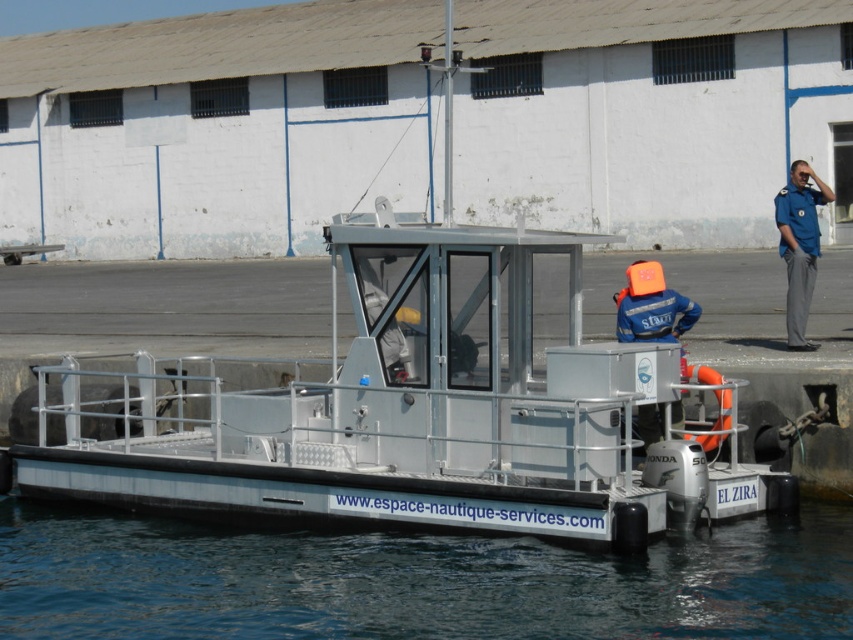
Looking at this image, who is shorter, blue water at lower center or orange rubber life jacket at right?

blue water at lower center

Between blue water at lower center and orange rubber life jacket at right, which one appears on the right side from the viewer's perspective?

From the viewer's perspective, orange rubber life jacket at right appears more on the right side.

Identify the location of blue water at lower center. Image resolution: width=853 pixels, height=640 pixels. (415, 580).

I want to click on blue water at lower center, so click(x=415, y=580).

Does point (795, 346) lie behind point (726, 406)?

Yes.

Is blue uniform at upper right positioned at the back of orange rubber life jacket at right?

Yes.

You are a GUI agent. You are given a task and a screenshot of the screen. Output one action in this format:
    pyautogui.click(x=<x>, y=<y>)
    Task: Click on the blue uniform at upper right
    This screenshot has height=640, width=853.
    Given the screenshot: What is the action you would take?
    pyautogui.click(x=799, y=244)

Can you confirm if orange foam helmet at center is positioned to the right of orange rubber life jacket at right?

In fact, orange foam helmet at center is to the left of orange rubber life jacket at right.

The image size is (853, 640). Describe the element at coordinates (651, 307) in the screenshot. I see `orange foam helmet at center` at that location.

Does point (675, 419) come closer to viewer compared to point (688, 438)?

No, it is behind (688, 438).

This screenshot has height=640, width=853. In order to click on orange foam helmet at center in this screenshot , I will do `click(651, 307)`.